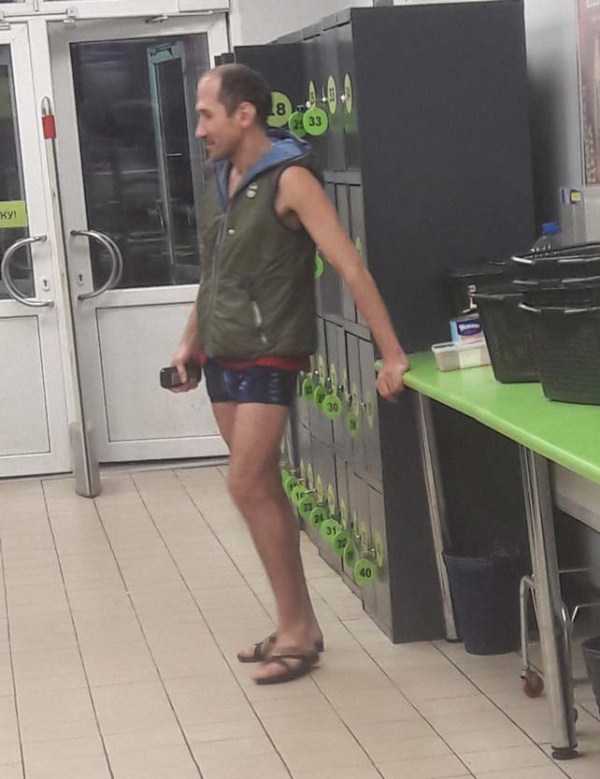
The height and width of the screenshot is (779, 600). Identify the location of lockers. (352, 369), (328, 476), (357, 509).